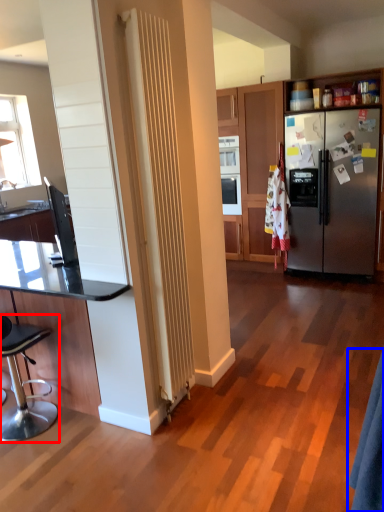
Question: Which point is closer to the camera, chair (highlighted by a red box) or robe (highlighted by a blue box)?

Choices:
 (A) chair
 (B) robe

Answer: (B)